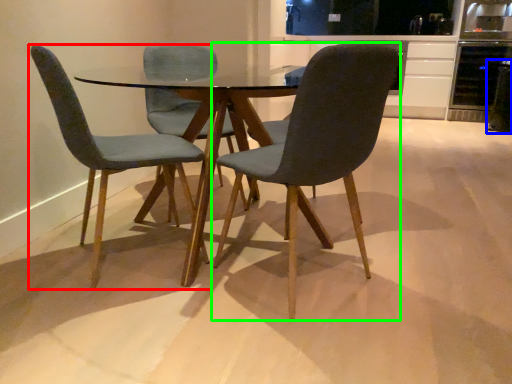
Question: Which object is the closest to the chair (highlighted by a red box)? Choose among these: appliance (highlighted by a blue box) or chair (highlighted by a green box).

Choices:
 (A) appliance
 (B) chair

Answer: (B)